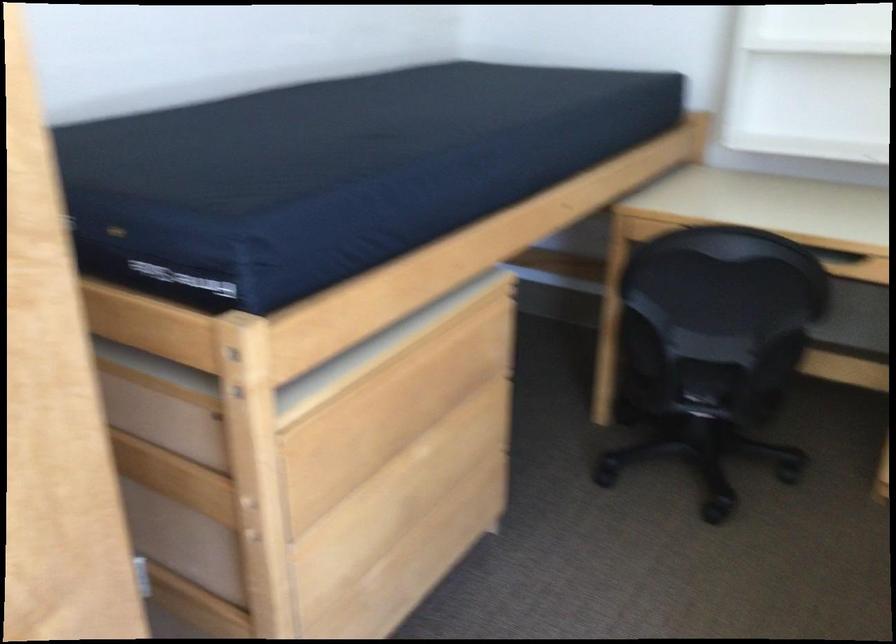
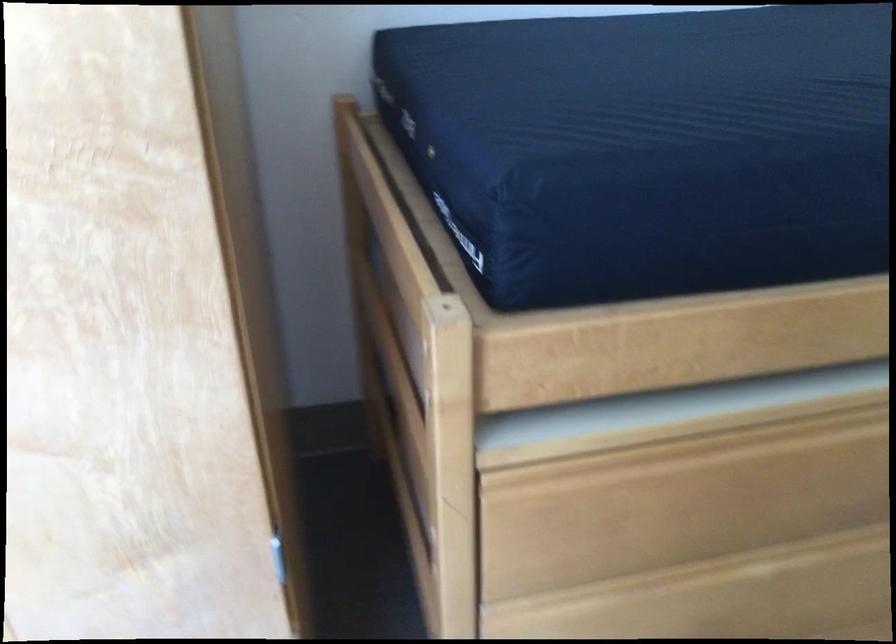
Question: The camera is either moving clockwise (left) or counter-clockwise (right) around the object. The first image is from the beginning of the video and the second image is from the end. Is the camera moving left or right when shooting the video?

Choices:
 (A) Left
 (B) Right

Answer: (B)